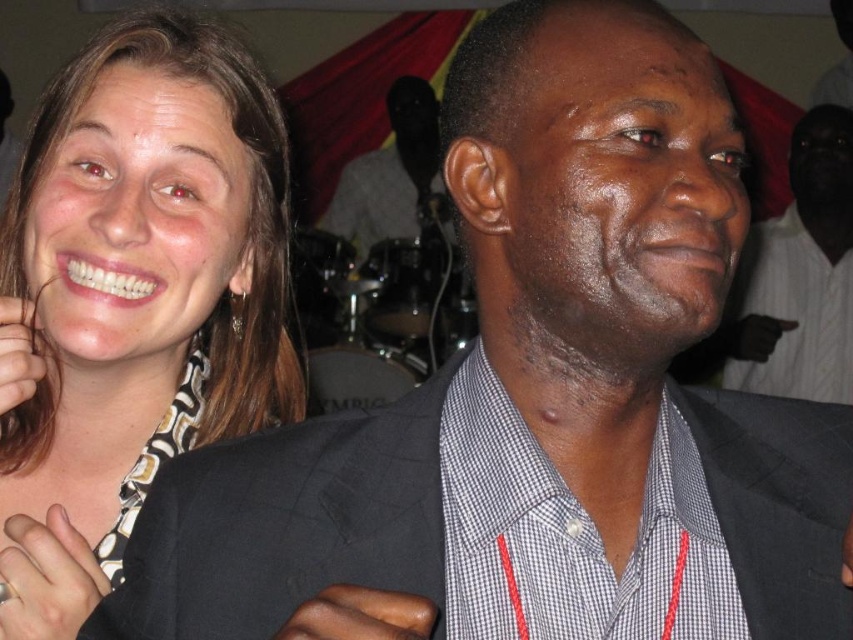
You are at a social event and want to take a photo of the two people standing at the points labeled as point (741,506) and point (49,548). To ensure both are in focus, you need to know which point is closer to the camera. Which point is closer?

Point (741,506) is in front of point (49,548), so it is closer to the camera.

You are a photographer adjusting your camera settings to focus on the black textured suit at center and the brown skin hand at center. Which object should you focus on first to ensure it appears sharp in the photo?

The black textured suit at center is closer to the viewer than the brown skin hand at center, so you should focus on the black textured suit at center first to ensure it appears sharp in the photo.